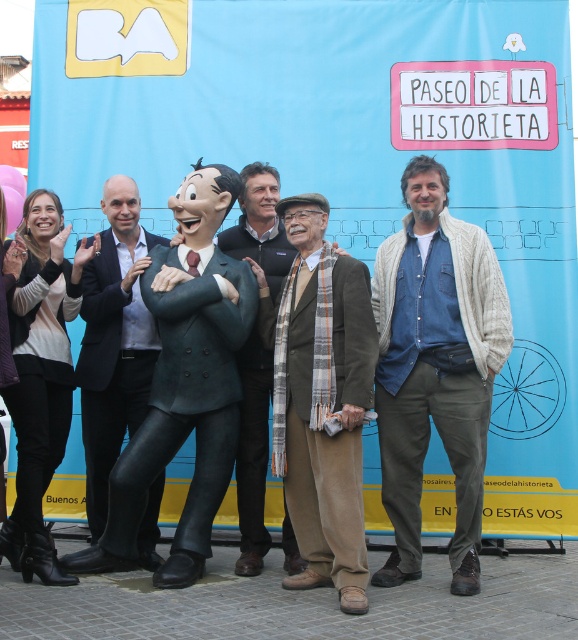
Question: Does brown woolen suit at center have a smaller size compared to dark green suit at center?

Choices:
 (A) yes
 (B) no

Answer: (B)

Question: Among these points, which one is farthest from the camera?

Choices:
 (A) (143, 248)
 (B) (253, 406)
 (C) (201, 179)

Answer: (A)

Question: Can you confirm if dark green suit at center is wider than brown wool scarf at center?

Choices:
 (A) yes
 (B) no

Answer: (A)

Question: Which of the following is the farthest from the observer?

Choices:
 (A) (142, 330)
 (B) (231, 314)

Answer: (A)

Question: Among these points, which one is farthest from the camera?

Choices:
 (A) (187, 506)
 (B) (90, 276)

Answer: (B)

Question: Is dark green suit at center behind brown wool scarf at center?

Choices:
 (A) no
 (B) yes

Answer: (A)